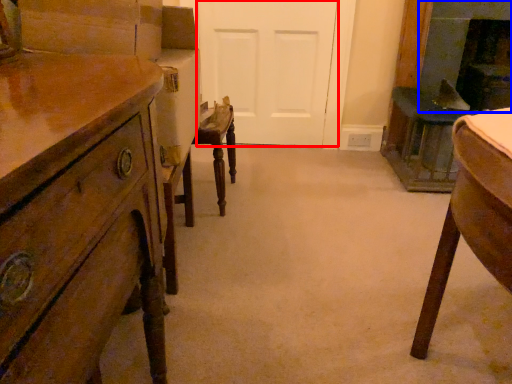
Question: Among these objects, which one is farthest to the camera, door (highlighted by a red box) or fireplace (highlighted by a blue box)?

Choices:
 (A) door
 (B) fireplace

Answer: (A)